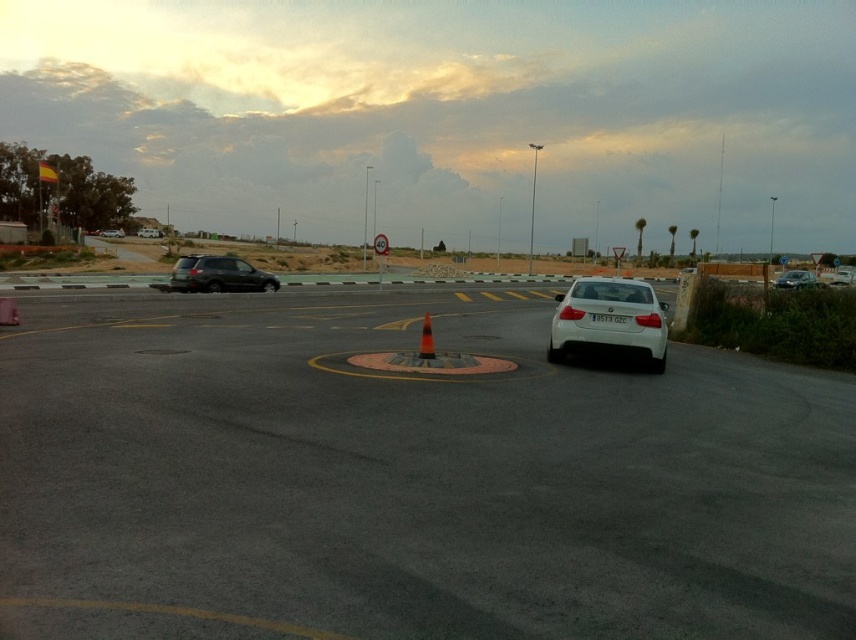
Question: Which is nearer to the white glossy car at center?

Choices:
 (A) white glossy sedan at center
 (B) white plastic license plate at center

Answer: (B)

Question: Is white glossy sedan at center in front of satin silver sedan at center?

Choices:
 (A) no
 (B) yes

Answer: (B)

Question: Which of the following is the farthest from the observer?

Choices:
 (A) (605, 314)
 (B) (431, 349)
 (C) (807, 278)

Answer: (C)

Question: In this image, where is white glossy sedan at center located relative to satin silver sedan at center?

Choices:
 (A) right
 (B) left

Answer: (B)

Question: Which object appears closest to the camera in this image?

Choices:
 (A) white glossy car at center
 (B) white glossy sedan at center
 (C) orange reflective cone at center
 (D) white plastic license plate at center

Answer: (A)

Question: Is satin black suv at left further to camera compared to satin silver sedan at center?

Choices:
 (A) no
 (B) yes

Answer: (B)